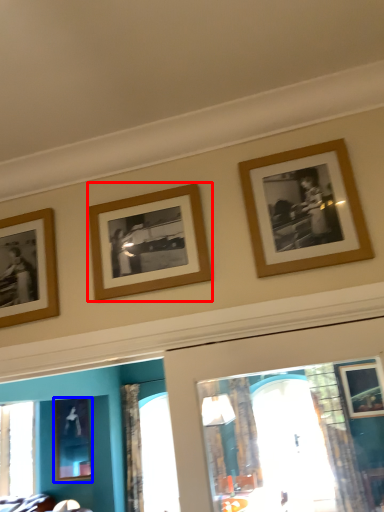
Question: Which object is further to the camera taking this photo, picture frame (highlighted by a red box) or picture frame (highlighted by a blue box)?

Choices:
 (A) picture frame
 (B) picture frame

Answer: (B)